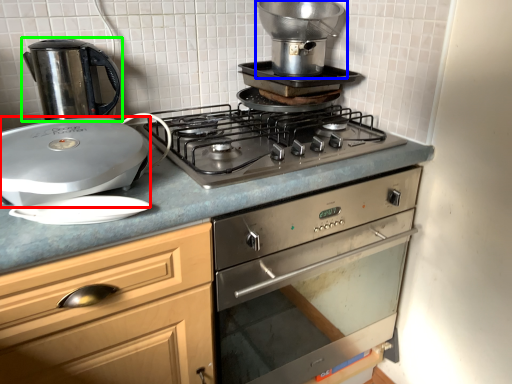
Question: Estimate the real-world distances between objects in this image. Which object is farther from kitchen appliance (highlighted by a red box), kitchen appliance (highlighted by a blue box) or kitchen appliance (highlighted by a green box)?

Choices:
 (A) kitchen appliance
 (B) kitchen appliance

Answer: (A)